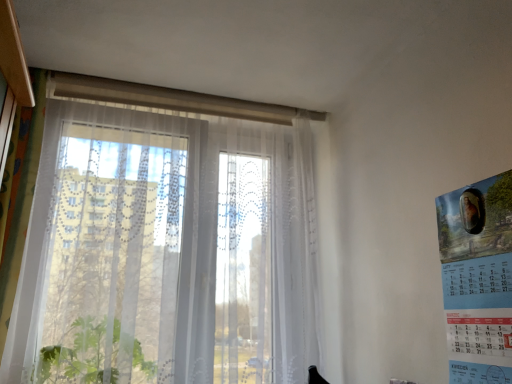
Question: From the image's perspective, is blue paper calendar at right above or below transparent fabric window at center?

Choices:
 (A) above
 (B) below

Answer: (B)

Question: In the image, is blue paper calendar at right on the left side or the right side of transparent fabric window at center?

Choices:
 (A) left
 (B) right

Answer: (B)

Question: Which is correct: blue paper calendar at right is inside transparent fabric window at center, or outside of it?

Choices:
 (A) outside
 (B) inside

Answer: (A)

Question: From the image's perspective, relative to blue paper calendar at right, is transparent fabric window at center above or below?

Choices:
 (A) below
 (B) above

Answer: (B)

Question: Do you think transparent fabric window at center is within blue paper calendar at right, or outside of it?

Choices:
 (A) inside
 (B) outside

Answer: (B)

Question: Is point (141, 175) closer or farther from the camera than point (459, 248)?

Choices:
 (A) farther
 (B) closer

Answer: (A)

Question: In the image, is transparent fabric window at center on the left side or the right side of blue paper calendar at right?

Choices:
 (A) left
 (B) right

Answer: (A)